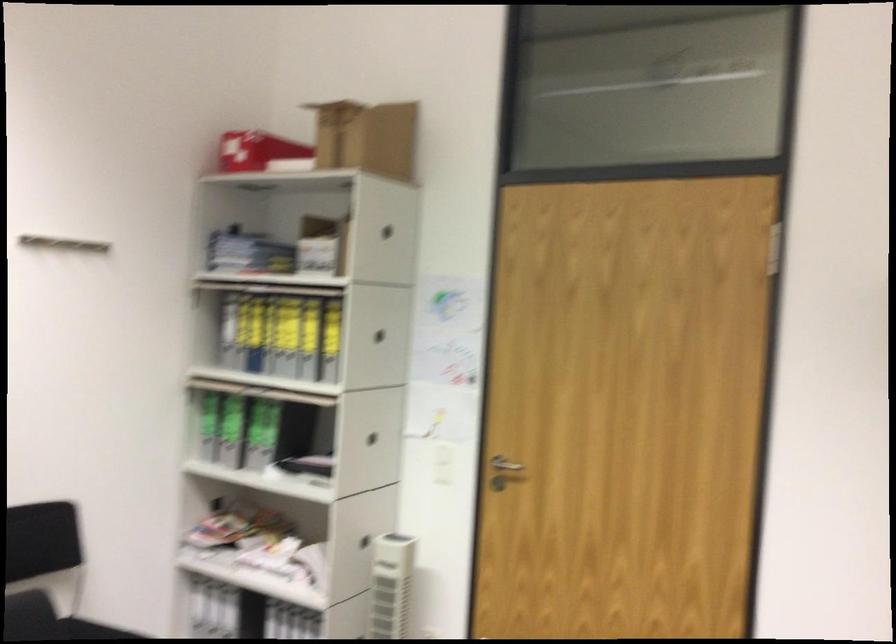
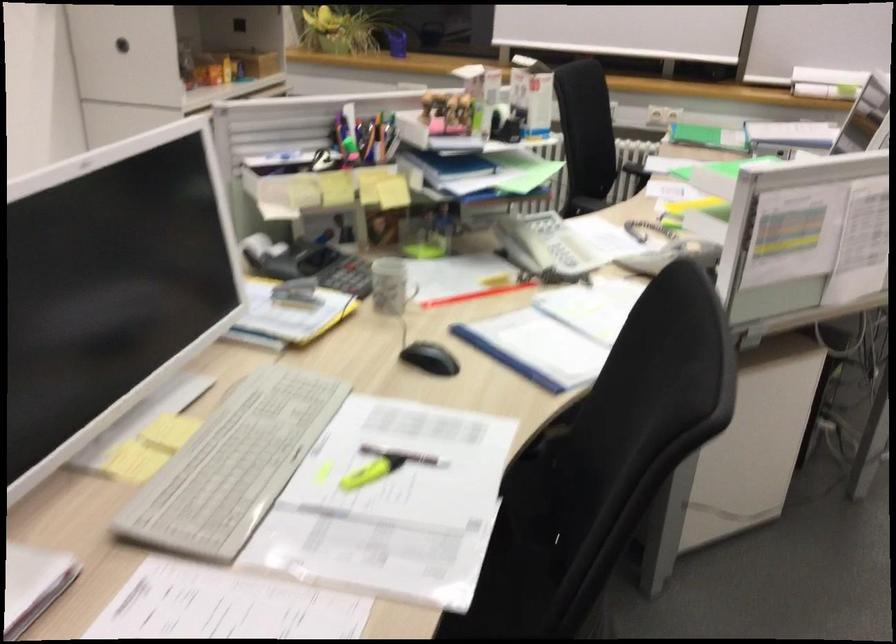
Question: I am providing you with two images of the same scene from different viewpoints. After the viewpoint changes to image2, which objects are now occluded?

Choices:
 (A) red pencil
 (B) shower control lever
 (C) chair sitting surface
 (D) round cabinet handle

Answer: (C)